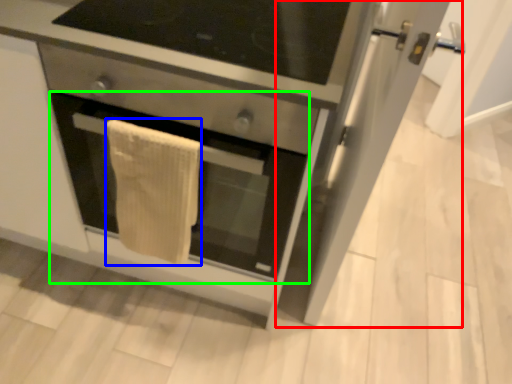
Question: Estimate the real-world distances between objects in this image. Which object is farther from glass door (highlighted by a red box), bath towel (highlighted by a blue box) or oven (highlighted by a green box)?

Choices:
 (A) bath towel
 (B) oven

Answer: (A)